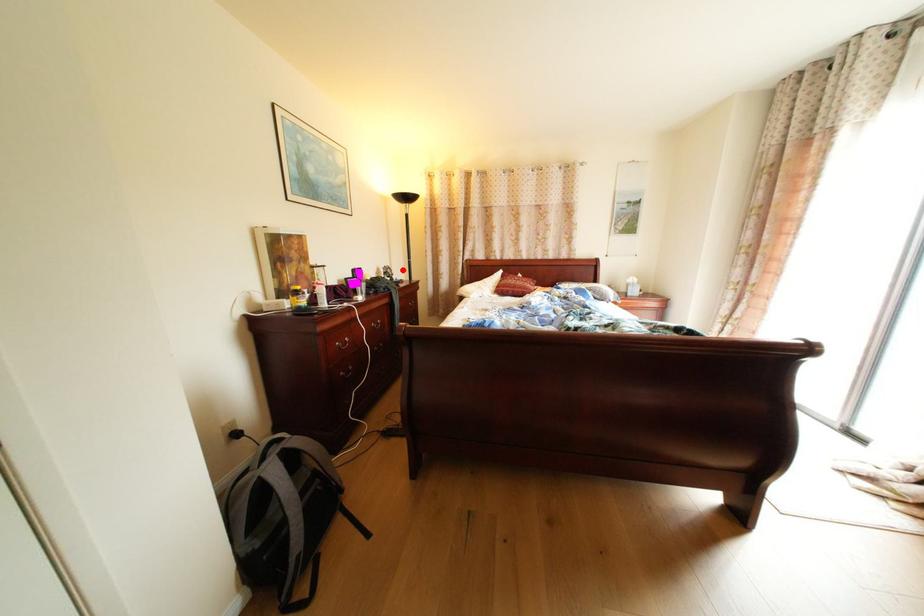
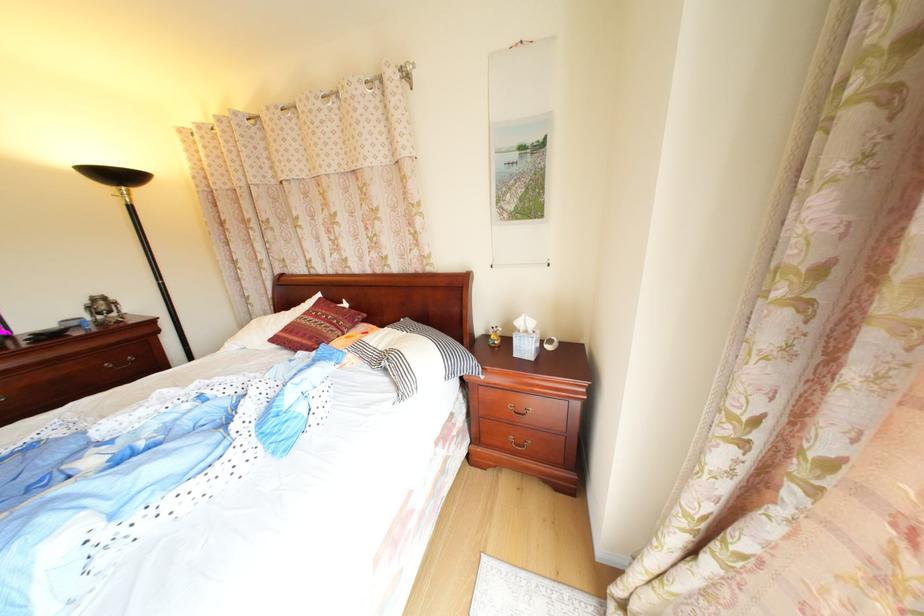
Question: I am providing you with two images of the same scene from different viewpoints. In image1, a red point is highlighted. Considering the same 3D point in image2, which of the following is correct?

Choices:
 (A) It is closer
 (B) It is farther

Answer: (B)